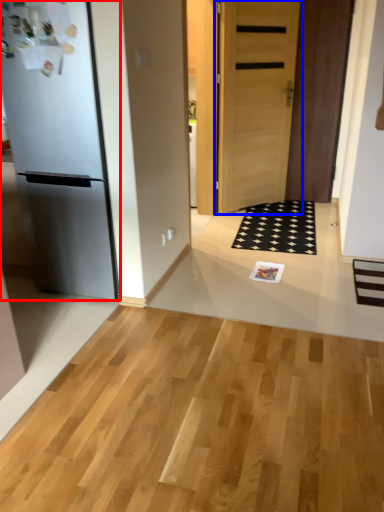
Question: Which object is closer to the camera taking this photo, refrigerator (highlighted by a red box) or door (highlighted by a blue box)?

Choices:
 (A) refrigerator
 (B) door

Answer: (A)